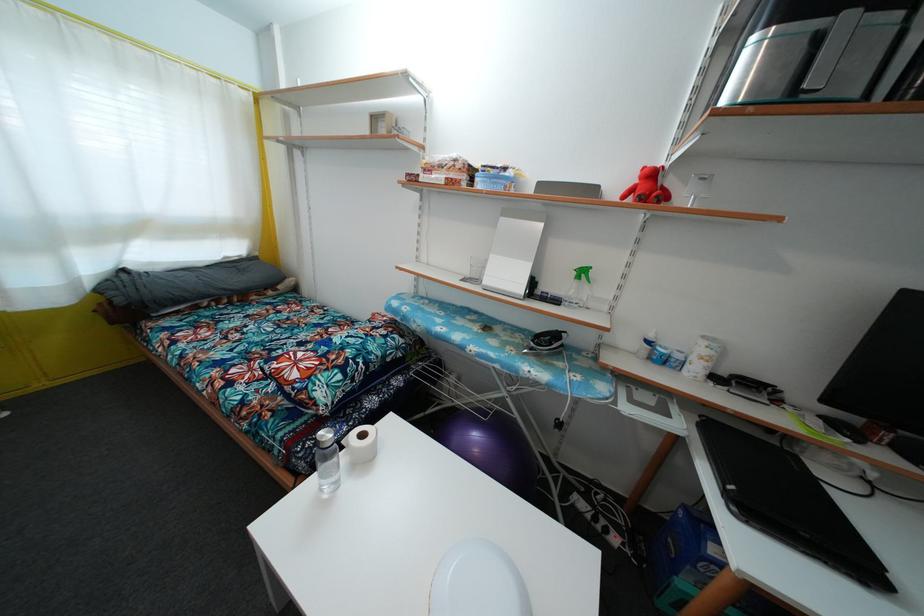
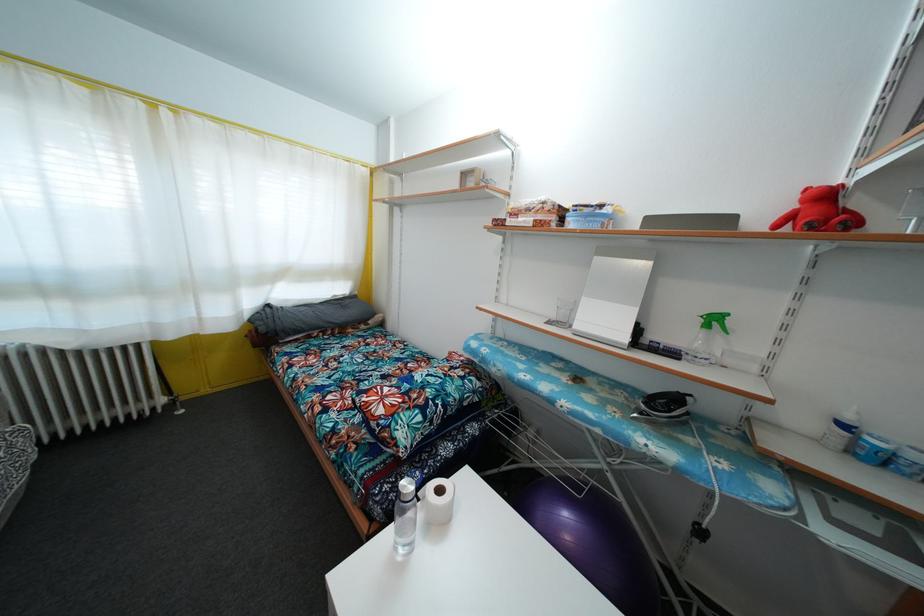
Locate, in the second image, the point that corresponds to [444,172] in the first image.

(531, 216)